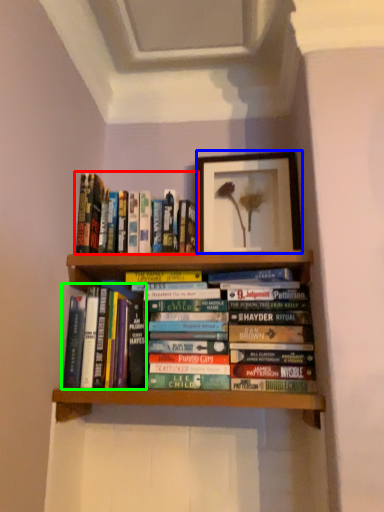
Question: Based on their relative distances, which object is nearer to book (highlighted by a red box)? Choose from picture frame (highlighted by a blue box) and book (highlighted by a green box).

Choices:
 (A) picture frame
 (B) book

Answer: (B)